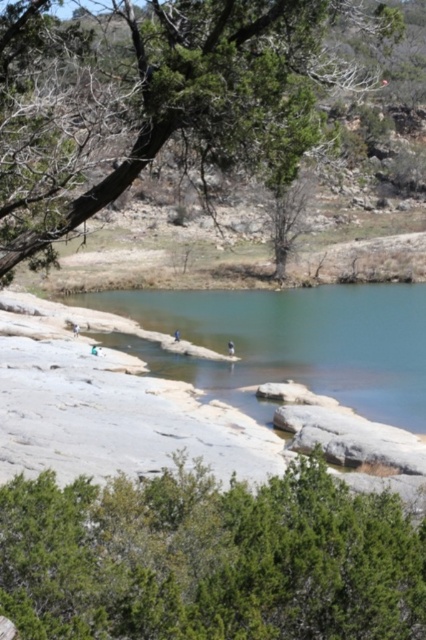
Question: Is green leafy bush at center bigger than clear blue water at center?

Choices:
 (A) no
 (B) yes

Answer: (A)

Question: Is green leafy bush at center bigger than clear blue water at center?

Choices:
 (A) no
 (B) yes

Answer: (A)

Question: Which is nearer to the green leafy bush at center?

Choices:
 (A) clear blue water at center
 (B) green leafy tree at upper left

Answer: (B)

Question: Which point is farther from the camera taking this photo?

Choices:
 (A) (207, 19)
 (B) (80, 611)
 (C) (213, 308)

Answer: (C)

Question: Which point is closer to the camera taking this photo?

Choices:
 (A) (115, 499)
 (B) (327, 364)
 (C) (310, 67)

Answer: (A)

Question: From the image, what is the correct spatial relationship of green leafy bush at center in relation to green leafy tree at upper left?

Choices:
 (A) left
 (B) right

Answer: (A)